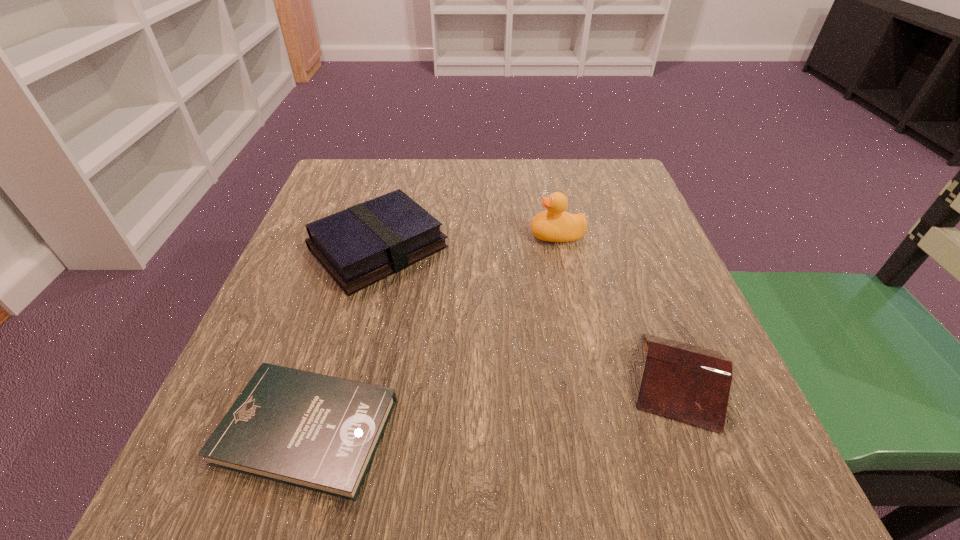
Identify the location of free space that is in between the duck and the tallest book. (468, 241).

I want to click on vacant area that lies between the second tallest object and the tallest object, so click(468, 241).

The image size is (960, 540). What are the coordinates of `blank region between the tallest book and the second tallest book` in the screenshot? It's located at (528, 314).

You are a GUI agent. You are given a task and a screenshot of the screen. Output one action in this format:
    pyautogui.click(x=<x>, y=<y>)
    Task: Click on the free spot between the second tallest book and the tallest object
    This screenshot has width=960, height=540.
    Given the screenshot: What is the action you would take?
    pyautogui.click(x=617, y=307)

The width and height of the screenshot is (960, 540). Find the location of `vacant area that lies between the second shortest object and the shortest book`. vacant area that lies between the second shortest object and the shortest book is located at coordinates (493, 405).

Choose which object is the nearest neighbor to the shortest book. Please provide its 2D coordinates. Your answer should be formatted as a tuple, i.e. [(x, y)], where the tuple contains the x and y coordinates of a point satisfying the conditions above.

[(365, 243)]

Locate an element on the screen. Image resolution: width=960 pixels, height=540 pixels. object that is the third closest to the duck is located at coordinates (317, 432).

Locate an element on the screen. The width and height of the screenshot is (960, 540). book that can be found as the second closest to the third shortest object is located at coordinates (688, 383).

Locate which book is the third closest to the tallest object. Please provide its 2D coordinates. Your answer should be formatted as a tuple, i.e. [(x, y)], where the tuple contains the x and y coordinates of a point satisfying the conditions above.

[(317, 432)]

At what (x,y) coordinates should I click in order to perform the action: click on vacant area that satisfies the following two spatial constraints: 1. on the face of the duck; 2. on the front side of the shortest book. Please return your answer as a coordinate pair (x, y). Looking at the image, I should click on (597, 430).